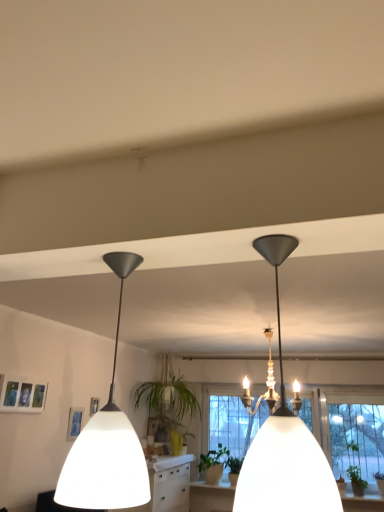
Describe the element at coordinates (212, 457) in the screenshot. The image size is (384, 512). I see `green matte plant at center, the 2th plant positioned from the front` at that location.

What is the approximate height of green matte plant at center, the 1th plant from the back?

The height of green matte plant at center, the 1th plant from the back, is 45.18 centimeters.

Where is `white matte lampshade at center, placed as the second lamp when sorted from left to right`? This screenshot has width=384, height=512. white matte lampshade at center, placed as the second lamp when sorted from left to right is located at coordinates (284, 441).

What do you see at coordinates (107, 443) in the screenshot?
I see `white matte pendant light at left, the first lamp viewed from the left` at bounding box center [107, 443].

The width and height of the screenshot is (384, 512). I want to click on white matte pendant light at left, the first lamp viewed from the left, so click(107, 443).

Where is `green matte plant at center, the 2th plant positioned from the front`? The image size is (384, 512). green matte plant at center, the 2th plant positioned from the front is located at coordinates (212, 457).

Is point (219, 443) positioned in front of point (361, 490)?

That is False.

In terms of height, does green matte plant at center, marked as the 2th plant in a right-to-left arrangement, look taller or shorter compared to green leafy plant at lower right, marked as the second plant in a back-to-front arrangement?

Considering their sizes, green matte plant at center, marked as the 2th plant in a right-to-left arrangement, has less height than green leafy plant at lower right, marked as the second plant in a back-to-front arrangement.

Considering the relative sizes of green matte plant at center, the 1th plant from the back, and green leafy plant at lower right, the 2th plant in the left-to-right sequence, in the image provided, is green matte plant at center, the 1th plant from the back, wider than green leafy plant at lower right, the 2th plant in the left-to-right sequence,?

No, green matte plant at center, the 1th plant from the back, is not wider than green leafy plant at lower right, the 2th plant in the left-to-right sequence.

Can you confirm if white matte pendant light at left, the first lamp viewed from the left, is taller than white matte lampshade at center, which ranks as the 1th lamp in right-to-left order?

Correct, white matte pendant light at left, the first lamp viewed from the left, is much taller as white matte lampshade at center, which ranks as the 1th lamp in right-to-left order.

Can you confirm if white matte pendant light at left, marked as the 2th lamp in a right-to-left arrangement, is wider than white matte lampshade at center, which ranks as the 1th lamp in right-to-left order?

Yes.

Based on the photo, could you tell me if white matte pendant light at left, the first lamp viewed from the left, is turned towards white matte lampshade at center, placed as the second lamp when sorted from left to right?

No, white matte pendant light at left, the first lamp viewed from the left, is not turned towards white matte lampshade at center, placed as the second lamp when sorted from left to right.

Is white matte lampshade at center, placed as the second lamp when sorted from left to right, placed right next to green matte plant at center, marked as the 2th plant in a right-to-left arrangement?

white matte lampshade at center, placed as the second lamp when sorted from left to right, and green matte plant at center, marked as the 2th plant in a right-to-left arrangement, are not in contact.

Is white matte lampshade at center, which ranks as the 1th lamp in right-to-left order, facing towards green matte plant at center, marked as the 2th plant in a right-to-left arrangement?

No.

Which is in front, point (254, 443) or point (211, 465)?

Point (254, 443)

Considering the relative sizes of green leafy plant at center and white matte pendant light at left, the first lamp viewed from the left, in the image provided, is green leafy plant at center thinner than white matte pendant light at left, the first lamp viewed from the left,?

Incorrect, the width of green leafy plant at center is not less than that of white matte pendant light at left, the first lamp viewed from the left.

Considering their positions, is green leafy plant at center located in front of or behind white matte pendant light at left, the first lamp viewed from the left?

green leafy plant at center is positioned farther from the viewer than white matte pendant light at left, the first lamp viewed from the left.

Is green leafy plant at center far away from white matte pendant light at left, marked as the 2th lamp in a right-to-left arrangement?

green leafy plant at center is far away from white matte pendant light at left, marked as the 2th lamp in a right-to-left arrangement.

Considering the relative sizes of white matte pendant light at left, marked as the 2th lamp in a right-to-left arrangement, and green leafy plant at center in the image provided, is white matte pendant light at left, marked as the 2th lamp in a right-to-left arrangement, shorter than green leafy plant at center?

Yes.

Considering the sizes of white matte pendant light at left, marked as the 2th lamp in a right-to-left arrangement, and green leafy plant at center in the image, is white matte pendant light at left, marked as the 2th lamp in a right-to-left arrangement, wider or thinner than green leafy plant at center?

In the image, white matte pendant light at left, marked as the 2th lamp in a right-to-left arrangement, appears to be more narrow than green leafy plant at center.

Are white matte pendant light at left, marked as the 2th lamp in a right-to-left arrangement, and green leafy plant at center far apart?

Yes, white matte pendant light at left, marked as the 2th lamp in a right-to-left arrangement, and green leafy plant at center are quite far apart.

In the image, is green matte plant at center, the 2th plant positioned from the front, on the left side or the right side of white matte pendant light at left, the first lamp viewed from the left?

green matte plant at center, the 2th plant positioned from the front, is to the right of white matte pendant light at left, the first lamp viewed from the left.

Can you see green matte plant at center, the 1th plant from the back, touching white matte pendant light at left, marked as the 2th lamp in a right-to-left arrangement?

No, green matte plant at center, the 1th plant from the back, is not in contact with white matte pendant light at left, marked as the 2th lamp in a right-to-left arrangement.

Is green matte plant at center, the 1th plant from the back, positioned with its back to white matte pendant light at left, the first lamp viewed from the left?

No, green matte plant at center, the 1th plant from the back,'s orientation is not away from white matte pendant light at left, the first lamp viewed from the left.

Would you consider green leafy plant at center to be distant from green leafy plant at lower right, marked as the second plant in a back-to-front arrangement?

Absolutely, green leafy plant at center is distant from green leafy plant at lower right, marked as the second plant in a back-to-front arrangement.

Can you tell me how much green leafy plant at center and green leafy plant at lower right, positioned as the first plant in right-to-left order, differ in facing direction?

The angle between the facing direction of green leafy plant at center and the facing direction of green leafy plant at lower right, positioned as the first plant in right-to-left order, is 90 degrees.

From a real-world perspective, relative to green leafy plant at lower right, the 2th plant in the left-to-right sequence, is green leafy plant at center vertically above or below?

Clearly, from a real-world perspective, green leafy plant at center is above green leafy plant at lower right, the 2th plant in the left-to-right sequence.

Who is smaller, green leafy plant at center or green leafy plant at lower right, the 2th plant in the left-to-right sequence?

Smaller between the two is green leafy plant at lower right, the 2th plant in the left-to-right sequence.

Image resolution: width=384 pixels, height=512 pixels. Identify the location of plant to the left of green leafy plant at lower right, the 1th plant when ordered from front to back. pos(212,457).

Find the location of `lamp behind the white matte lampshade at center, placed as the second lamp when sorted from left to right`. lamp behind the white matte lampshade at center, placed as the second lamp when sorted from left to right is located at coordinates (107, 443).

Looking at the image, which one is located further to white matte pendant light at left, the first lamp viewed from the left, white matte lampshade at center, placed as the second lamp when sorted from left to right, or green matte plant at center, the 1th plant when ordered from left to right?

Based on the image, green matte plant at center, the 1th plant when ordered from left to right, appears to be further to white matte pendant light at left, the first lamp viewed from the left.

Looking at the image, which one is located closer to white matte pendant light at left, marked as the 2th lamp in a right-to-left arrangement, green leafy plant at center or green matte plant at center, the 1th plant when ordered from left to right?

Based on the image, green leafy plant at center appears to be nearer to white matte pendant light at left, marked as the 2th lamp in a right-to-left arrangement.

When comparing their distances from green leafy plant at lower right, the 2th plant in the left-to-right sequence, does green matte plant at center, marked as the 2th plant in a right-to-left arrangement, or white matte pendant light at left, the first lamp viewed from the left, seem further?

Among the two, white matte pendant light at left, the first lamp viewed from the left, is located further to green leafy plant at lower right, the 2th plant in the left-to-right sequence.

Considering their positions, is green leafy plant at lower right, marked as the second plant in a back-to-front arrangement, positioned further to white matte pendant light at left, marked as the 2th lamp in a right-to-left arrangement, than green matte plant at center, the 2th plant positioned from the front?

green leafy plant at lower right, marked as the second plant in a back-to-front arrangement, is further to white matte pendant light at left, marked as the 2th lamp in a right-to-left arrangement.

Based on their spatial positions, is white matte pendant light at left, the first lamp viewed from the left, or green matte plant at center, the 1th plant from the back, closer to green leafy plant at center?

Based on the image, green matte plant at center, the 1th plant from the back, appears to be nearer to green leafy plant at center.

From the image, which object appears to be farther from white matte pendant light at left, the first lamp viewed from the left, green leafy plant at center or green leafy plant at lower right, positioned as the first plant in right-to-left order?

green leafy plant at lower right, positioned as the first plant in right-to-left order, lies further to white matte pendant light at left, the first lamp viewed from the left, than the other object.

Which object lies nearer to the anchor point green matte plant at center, the 2th plant positioned from the front, green leafy plant at lower right, the 2th plant in the left-to-right sequence, or white matte lampshade at center, which ranks as the 1th lamp in right-to-left order?

green leafy plant at lower right, the 2th plant in the left-to-right sequence, is closer to green matte plant at center, the 2th plant positioned from the front.

Looking at the image, which one is located further to green matte plant at center, marked as the 2th plant in a right-to-left arrangement, green leafy plant at lower right, marked as the second plant in a back-to-front arrangement, or green leafy plant at center?

The object further to green matte plant at center, marked as the 2th plant in a right-to-left arrangement, is green leafy plant at lower right, marked as the second plant in a back-to-front arrangement.

Where is `plant between white matte lampshade at center, placed as the second lamp when sorted from left to right, and green matte plant at center, the 1th plant from the back, from front to back`? plant between white matte lampshade at center, placed as the second lamp when sorted from left to right, and green matte plant at center, the 1th plant from the back, from front to back is located at coordinates (356, 480).

The image size is (384, 512). In order to click on plant between green leafy plant at center and green leafy plant at lower right, positioned as the first plant in right-to-left order, from left to right in this screenshot , I will do `click(212, 457)`.

I want to click on houseplant positioned between white matte lampshade at center, which ranks as the 1th lamp in right-to-left order, and green matte plant at center, the 2th plant positioned from the front, from near to far, so click(x=169, y=405).

I want to click on plant located between white matte pendant light at left, marked as the 2th lamp in a right-to-left arrangement, and green leafy plant at center in the depth direction, so click(x=356, y=480).